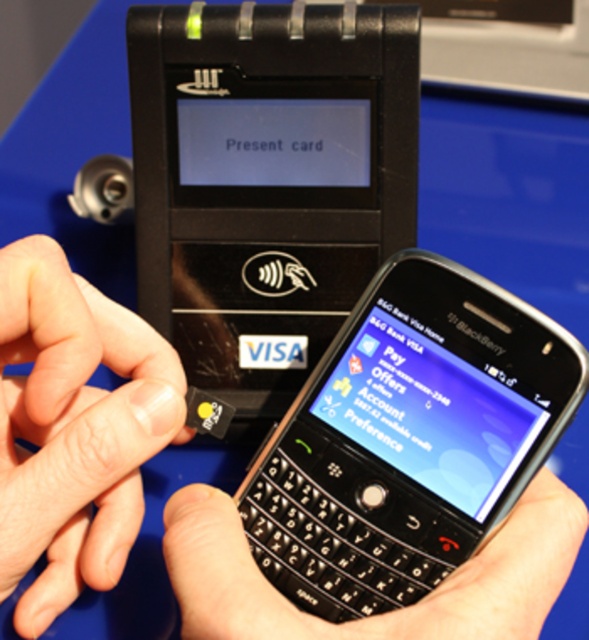
Question: Does black plastic smartphone at center have a greater width compared to flesh-toned skin at center?

Choices:
 (A) yes
 (B) no

Answer: (A)

Question: Based on their relative distances, which object is farther from the black plastic smartphone at center?

Choices:
 (A) flesh-toned skin at center
 (B) black matte keyboard at center

Answer: (A)

Question: Does black plastic smartphone at center have a smaller size compared to flesh-toned skin at center?

Choices:
 (A) yes
 (B) no

Answer: (A)

Question: Considering the real-world distances, which object is farthest from the black matte keyboard at center?

Choices:
 (A) flesh-toned skin at center
 (B) black plastic smartphone at center

Answer: (A)

Question: Can you confirm if black plastic smartphone at center is thinner than black matte keyboard at center?

Choices:
 (A) no
 (B) yes

Answer: (B)

Question: Considering the real-world distances, which object is closest to the flesh-toned skin at center?

Choices:
 (A) black plastic smartphone at center
 (B) black matte keyboard at center

Answer: (B)